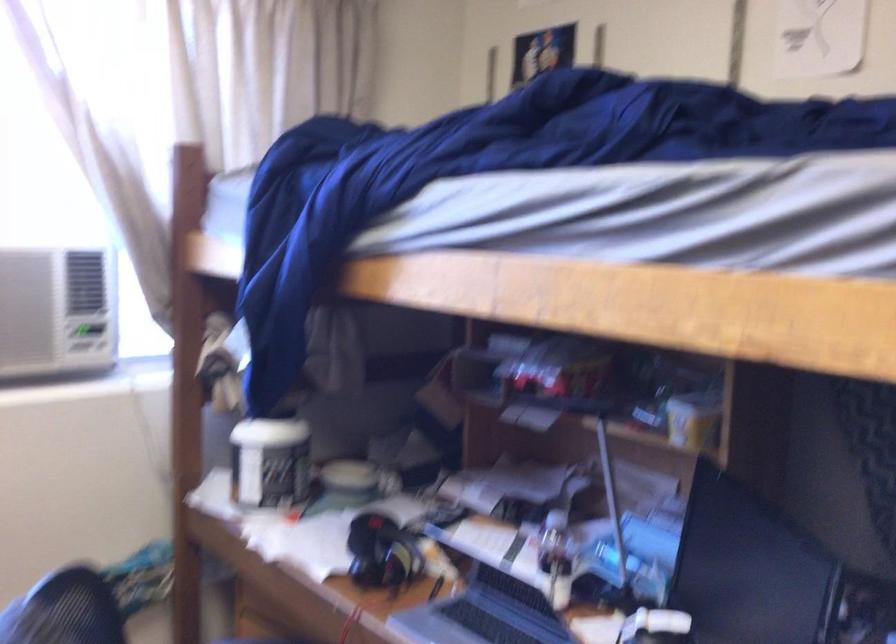
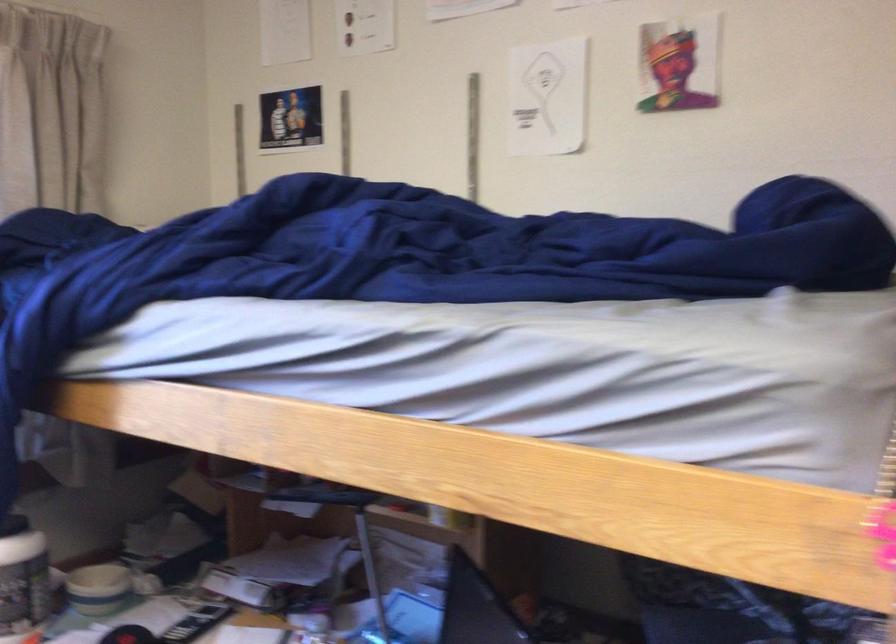
Locate, in the second image, the point that corresponds to point 348,480 in the first image.

(98, 589)